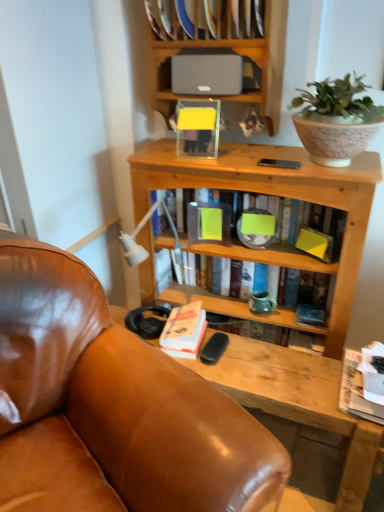
Where is `free space above satin gray speaker at upper center (from a real-world perspective)`? Image resolution: width=384 pixels, height=512 pixels. free space above satin gray speaker at upper center (from a real-world perspective) is located at coordinates (216, 48).